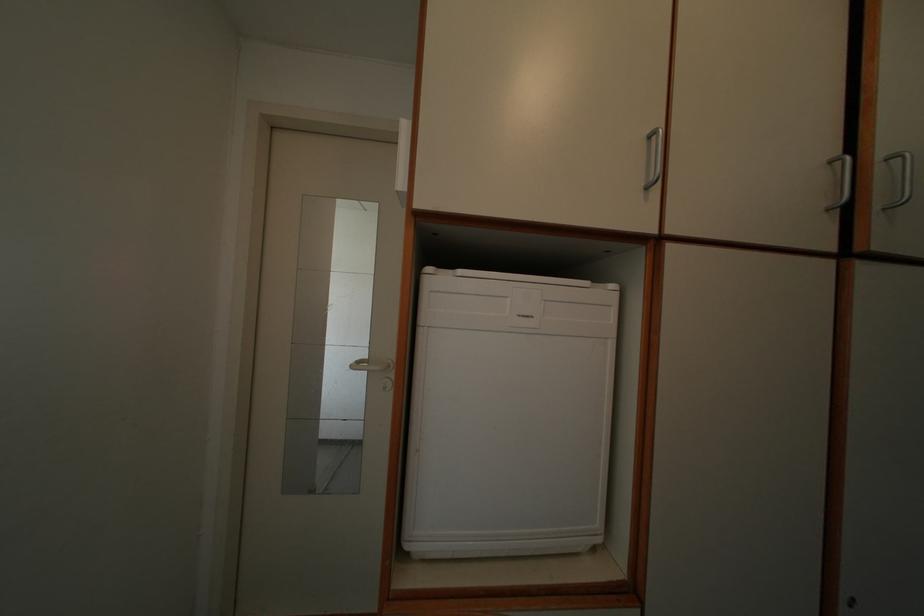
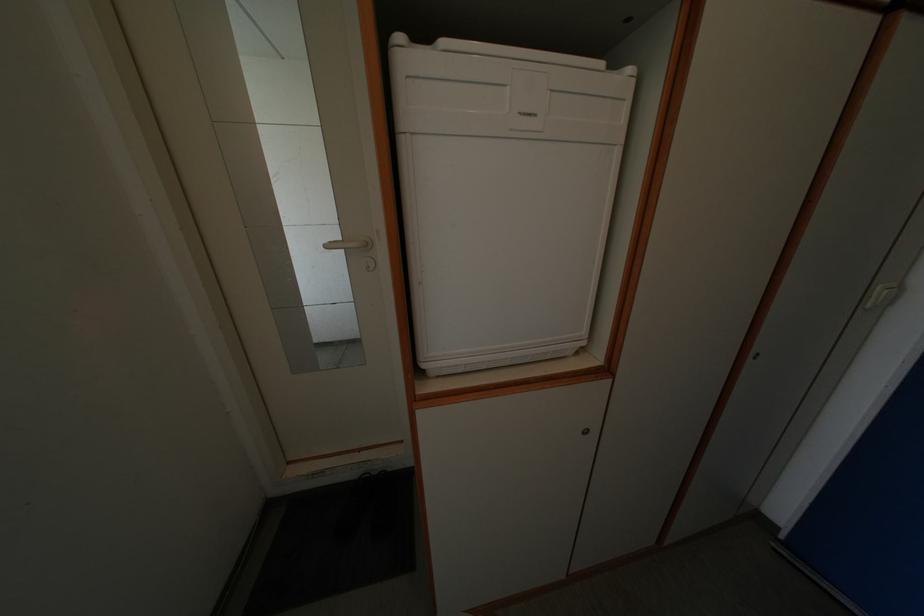
Where in the second image is the point corresponding to point 359,366 from the first image?

(332, 246)